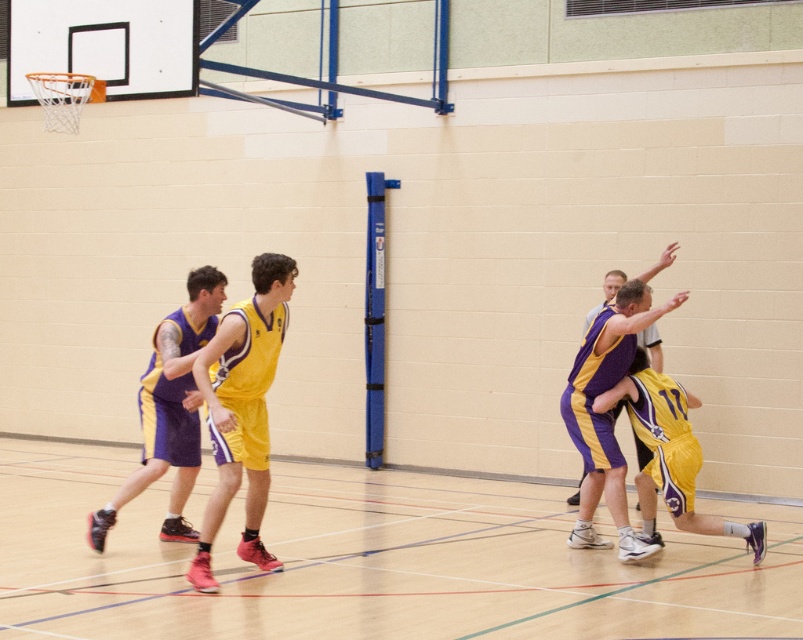
Does wooden floor at center lie in front of purple/yellow jersey at center?

Yes, wooden floor at center is closer to the viewer.

Is wooden floor at center wider than purple/yellow jersey at center?

Yes, wooden floor at center is wider than purple/yellow jersey at center.

Describe the element at coordinates (369, 561) in the screenshot. I see `wooden floor at center` at that location.

Locate an element on the screen. Image resolution: width=803 pixels, height=640 pixels. wooden floor at center is located at coordinates (369, 561).

Is yellow jersey at center below yellow matte shorts at center?

Incorrect, yellow jersey at center is not positioned below yellow matte shorts at center.

Identify the location of yellow jersey at center. This screenshot has height=640, width=803. (243, 408).

Is purple/yellow jersey at center positioned in front of yellow matte shorts at center?

That is False.

From the picture: Can you confirm if purple/yellow jersey at center is positioned above yellow matte shorts at center?

Indeed, purple/yellow jersey at center is positioned over yellow matte shorts at center.

Is point (222, 412) closer to camera compared to point (604, 392)?

Yes.

Where is `purple/yellow jersey at center`? This screenshot has height=640, width=803. purple/yellow jersey at center is located at coordinates (239, 413).